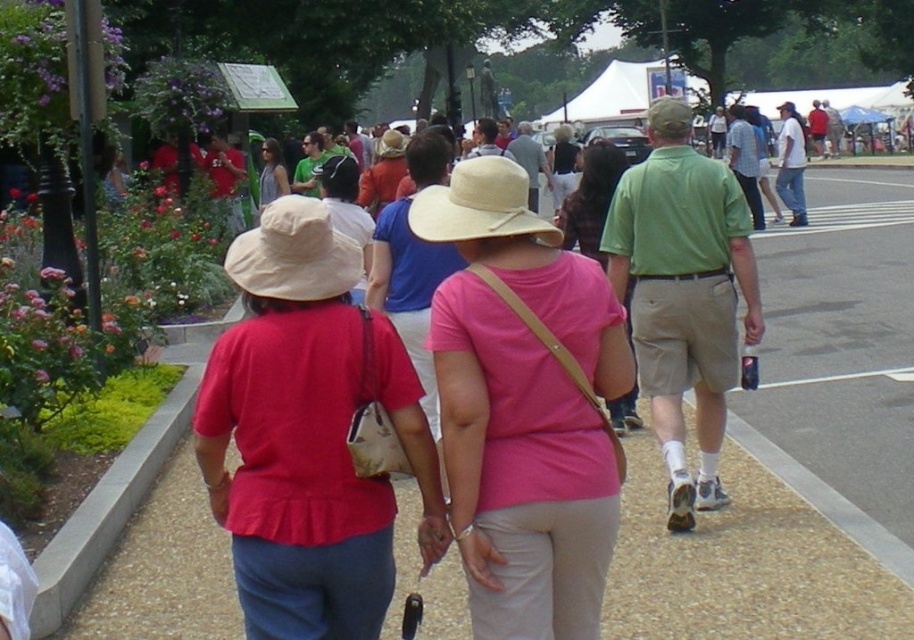
You are a photographer trying to capture a candid shot of the matte red shirt at center and the matte gray tank top at center. Which person should you focus on first if you want to photograph the one closer to the camera?

The matte red shirt at center is positioned under the matte gray tank top at center, so the matte gray tank top at center is closer to the camera. Focus on the matte gray tank top at center first.

You are standing at the edge of the scene and want to walk along the path to the flower beds on the left. Which object, the brown gravel path at center or the matte red shirt at center, is higher in elevation and would require climbing up to reach?

The brown gravel path at center is much taller than the matte red shirt at center, so you would need to climb up to reach the brown gravel path at center.